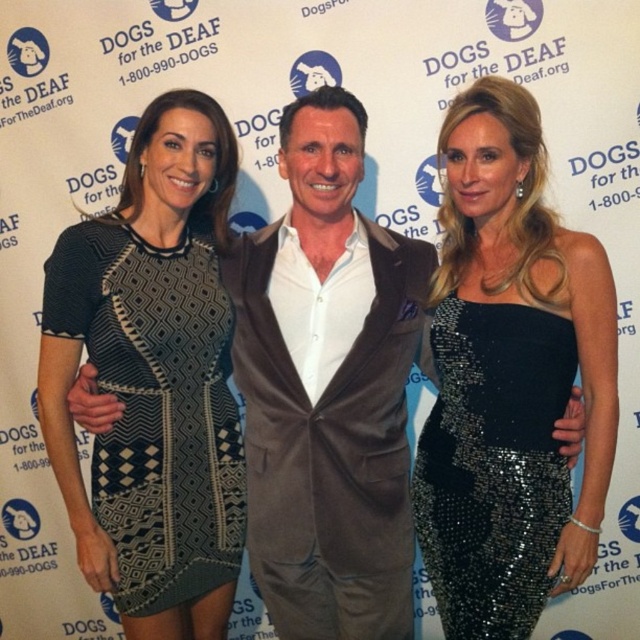
Question: Estimate the real-world distances between objects in this image. Which object is farther from the black sequined dress at right?

Choices:
 (A) black sequined dress at center
 (B) matte brown suit at center

Answer: (B)

Question: Can you confirm if black sequined dress at center is positioned to the right of black textured dress at left?

Choices:
 (A) yes
 (B) no

Answer: (A)

Question: Which point is farther from the camera taking this photo?

Choices:
 (A) (442, 534)
 (B) (195, 252)

Answer: (B)

Question: Among these points, which one is nearest to the camera?

Choices:
 (A) (307, 525)
 (B) (232, 458)

Answer: (A)

Question: Is matte brown suit at center smaller than black textured dress at left?

Choices:
 (A) yes
 (B) no

Answer: (B)

Question: Is matte brown suit at center further to camera compared to black sequined dress at right?

Choices:
 (A) yes
 (B) no

Answer: (A)